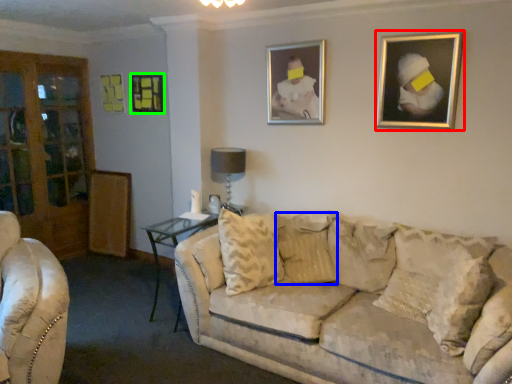
Question: Which object is positioned closest to picture frame (highlighted by a red box)? Select from pillow (highlighted by a blue box) and picture frame (highlighted by a green box).

Choices:
 (A) pillow
 (B) picture frame

Answer: (A)